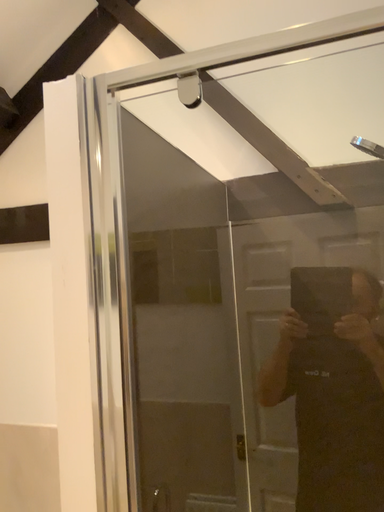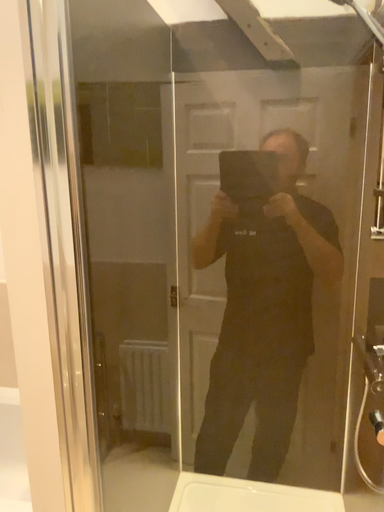
Question: How did the camera likely rotate when shooting the video?

Choices:
 (A) rotated left
 (B) rotated right

Answer: (B)